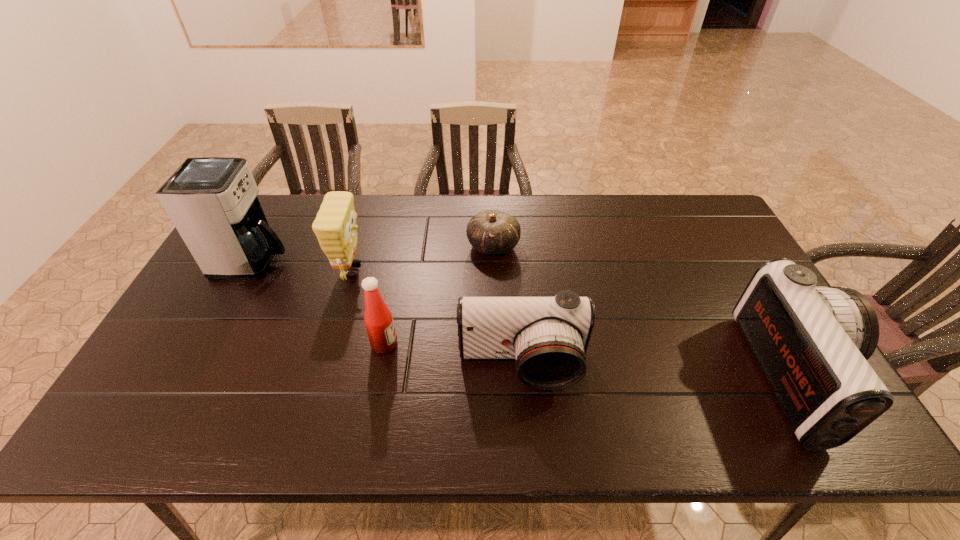
In order to click on blank area located on the front panel of the coffee maker in this screenshot , I will do `click(349, 261)`.

Find the location of `vacant space located 0.250m on the front-facing side of the condiment`. vacant space located 0.250m on the front-facing side of the condiment is located at coordinates (493, 345).

In order to click on object present at the far edge in this screenshot , I will do click(490, 232).

Where is `object that is at the left edge`? object that is at the left edge is located at coordinates (212, 201).

Locate an element on the screen. The image size is (960, 540). object present at the right edge is located at coordinates (812, 343).

Find the location of a particular element. Image resolution: width=960 pixels, height=540 pixels. object situated at the near right corner is located at coordinates (812, 343).

Where is `vacant area at the far edge of the desktop`? This screenshot has width=960, height=540. vacant area at the far edge of the desktop is located at coordinates (516, 197).

The width and height of the screenshot is (960, 540). I want to click on free space at the near edge, so click(x=446, y=369).

Identify the location of vacant area at the right edge of the desktop. (748, 274).

The height and width of the screenshot is (540, 960). What are the coordinates of `vacant space at the near left corner` in the screenshot? It's located at (159, 390).